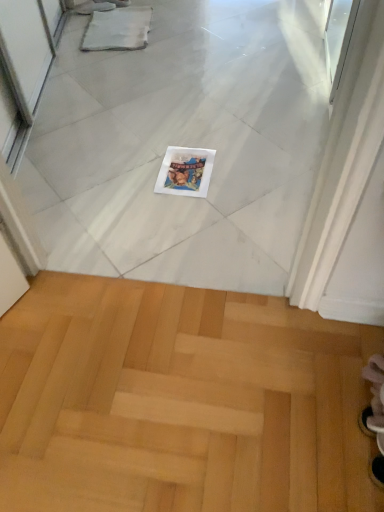
Identify the location of vacant area on top of light wood parquet floor at lower center (from a real-world perspective). (179, 384).